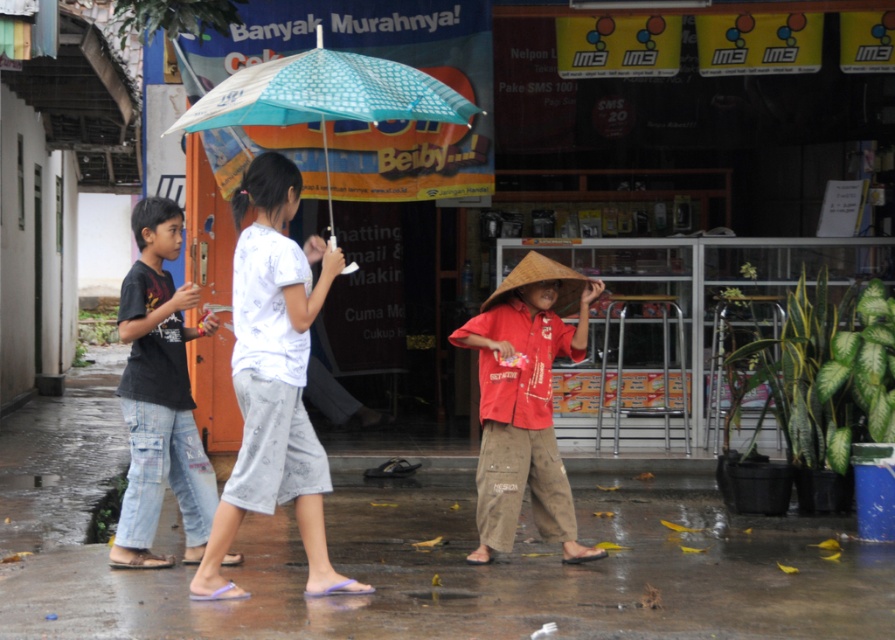
You are a photographer trying to capture a photo of the two children in the scene. The children wearing the red cotton shirt at center and dark blue jeans at left are walking towards the street corner. Which child should you focus on first to ensure they are in the frame before the other?

The dark blue jeans at left should be focused on first because the red cotton shirt at center is to the right of dark blue jeans at left, meaning the child in dark blue jeans is closer to the photographer and will reach the frame first.

You are a photographer standing at the center of the street and want to take a photo of the white cotton shirt at center. According to the coordinates provided, where should you aim your camera?

The white cotton shirt at center is located at coordinates point (274,380), so you should aim your camera at that position to capture it.

You are standing at the center of the street and see the dark blue jeans at left. Based on their position, which direction should you walk to reach them?

Since the dark blue jeans at left is located at point (159, 396), you should walk towards the left side of the street to reach them.